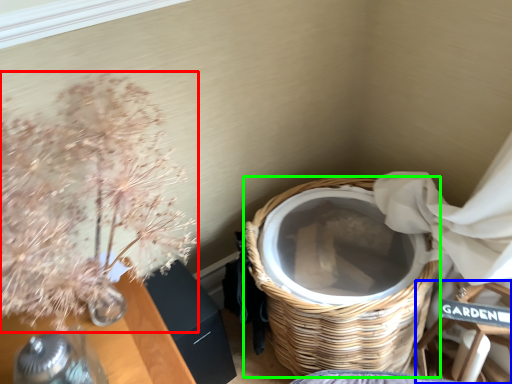
Question: Which object is the farthest from floral arrangement (highlighted by a red box)? Choose among these: armchair (highlighted by a blue box) or basket (highlighted by a green box).

Choices:
 (A) armchair
 (B) basket

Answer: (A)